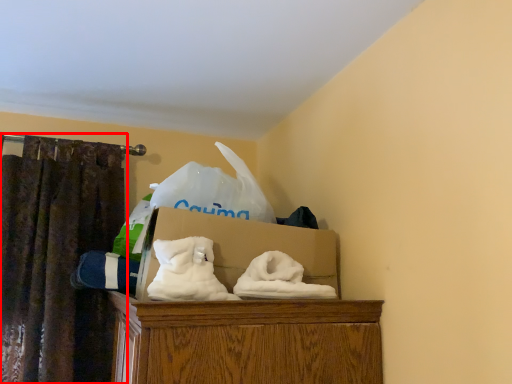
Question: Observing the image, what is the correct spatial positioning of curtain (annotated by the red box) in reference to box?

Choices:
 (A) right
 (B) left

Answer: (B)